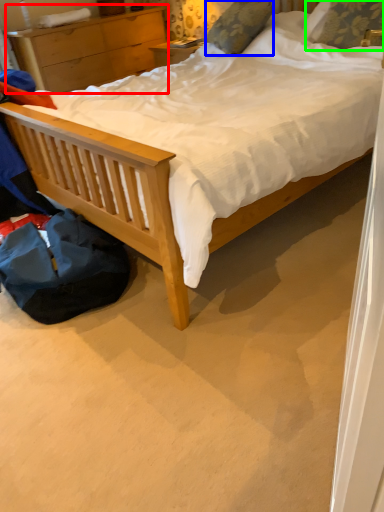
Question: Which is farther away from nightstand (highlighted by a red box)? pillow (highlighted by a blue box) or pillow (highlighted by a green box)?

Choices:
 (A) pillow
 (B) pillow

Answer: (B)